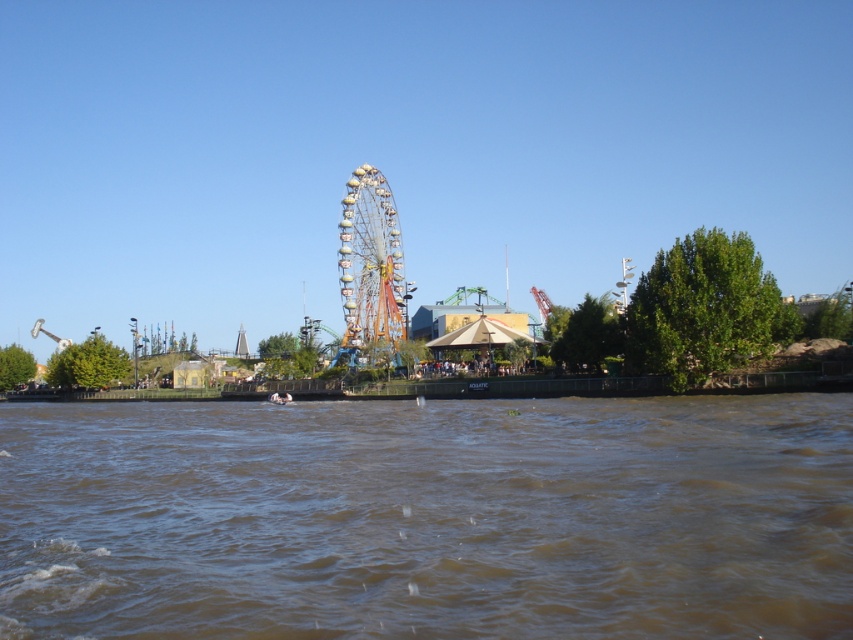
You are standing at the edge of the water in the amusement park scene. There is a point marked at coordinates (723, 314). What object is located at that point?

The metallic ferris wheel at center is located at point (723, 314).